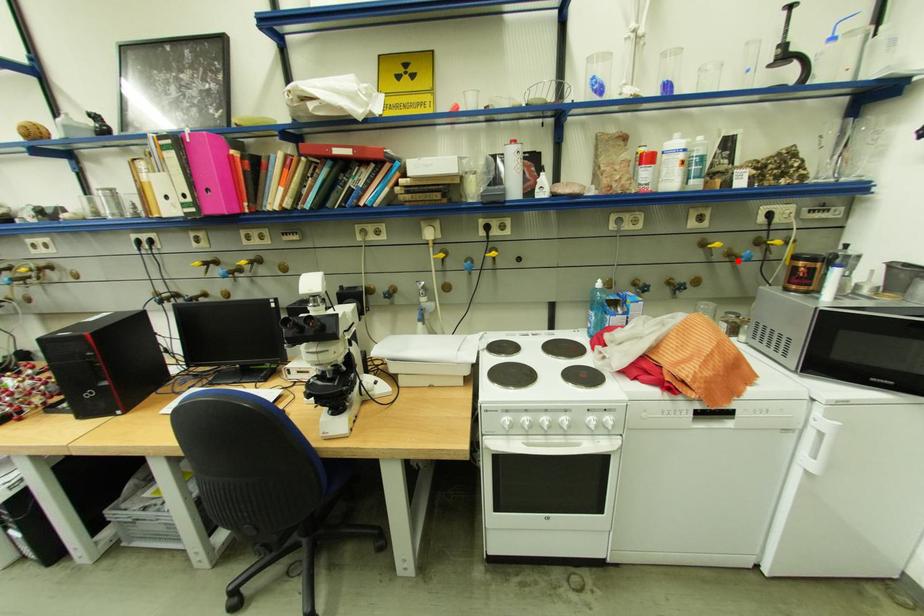
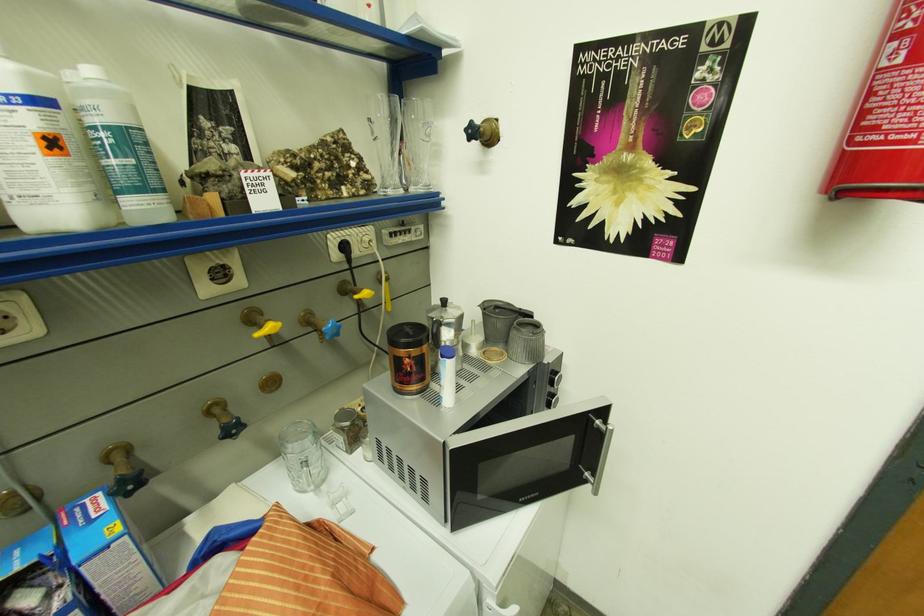
The point at the highlighted location is marked in the first image. Where is the corresponding point in the second image?

(322, 331)